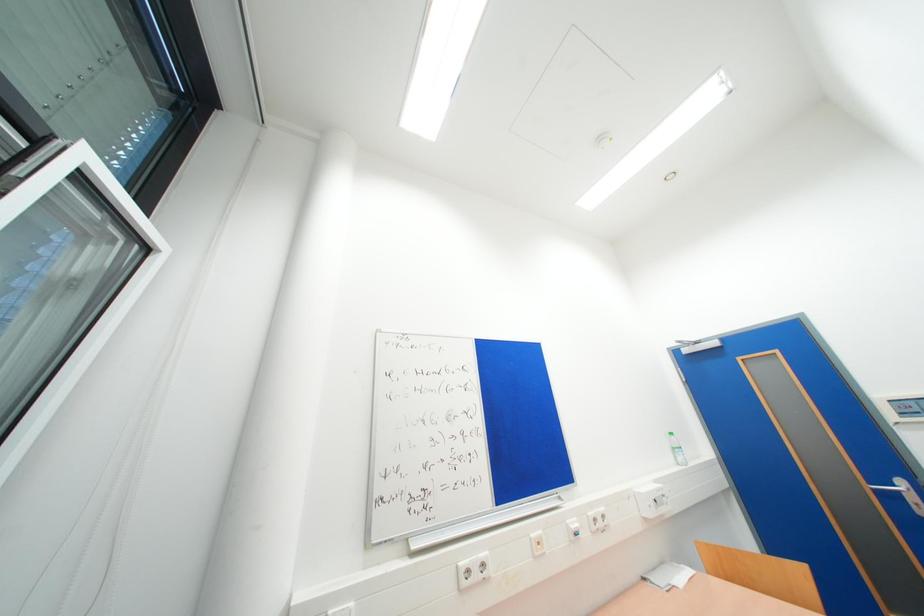
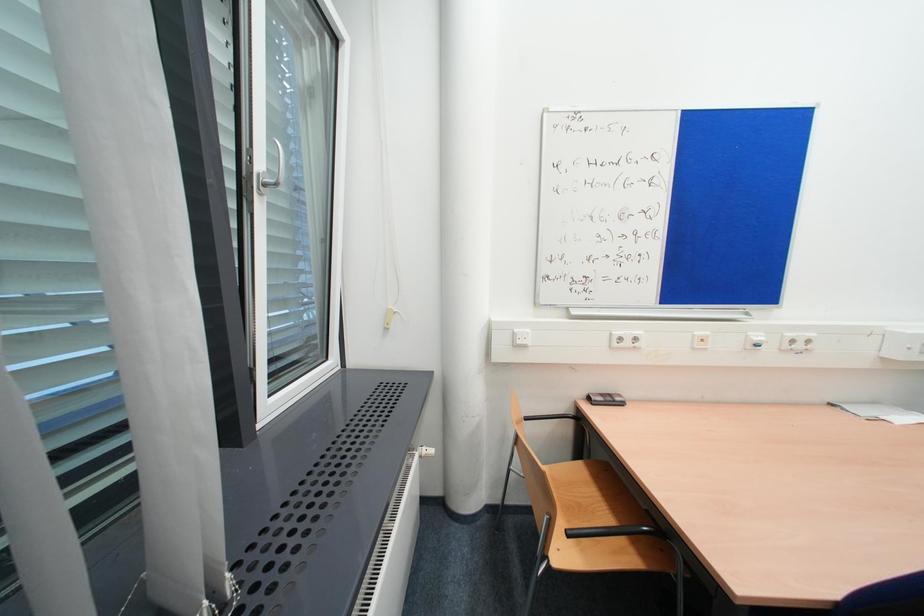
The first image is from the beginning of the video and the second image is from the end. How did the camera likely rotate when shooting the video?

The camera rotated toward left-down.